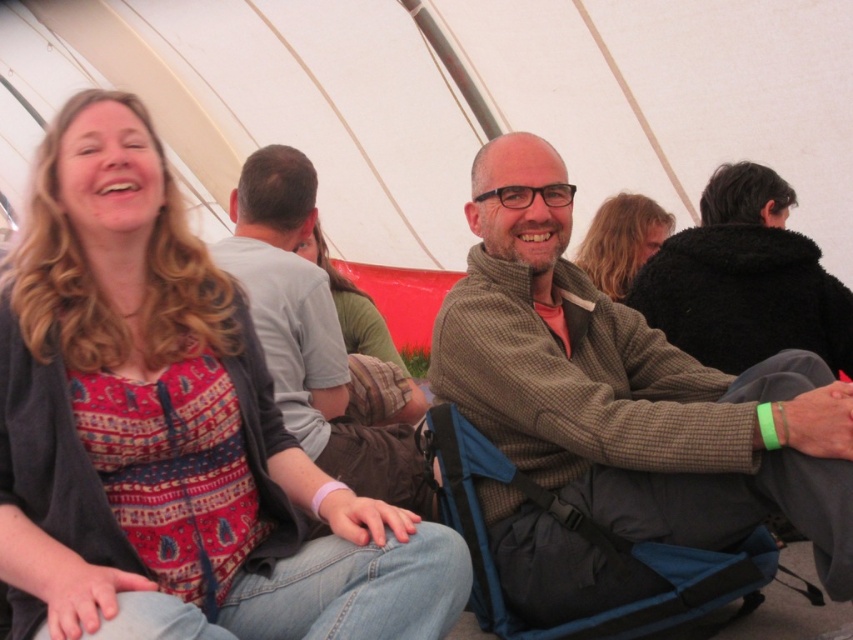
You are planning to sit between the blue fabric folding chair at center and the blonde hair at center. Which object is wider so you can choose the wider one for comfort?

The blue fabric folding chair at center is wider than the blonde hair at center, so you should choose the blue fabric folding chair at center for comfort.

You are standing at the entrance of the tent and want to see the blonde hair at center. Is the black fuzzy coat at upper right blocking your view of it?

The black fuzzy coat at upper right is in front of the blonde hair at center, so it would block your view of the blonde hair at center.

Based on the scene described, can you determine which object is taller between the black fuzzy coat at upper right and the blonde hair at center?

The black fuzzy coat at upper right is much taller than the blonde hair at center.